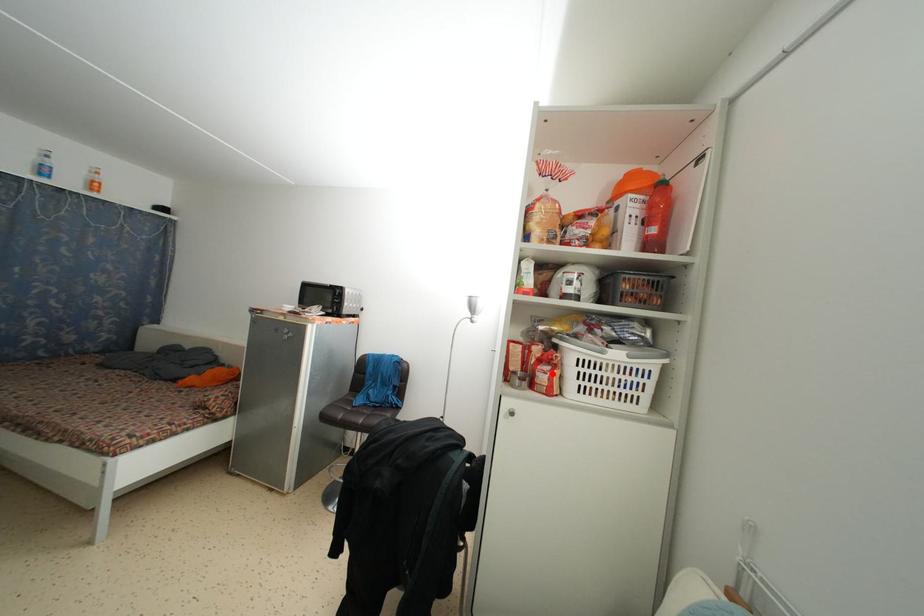
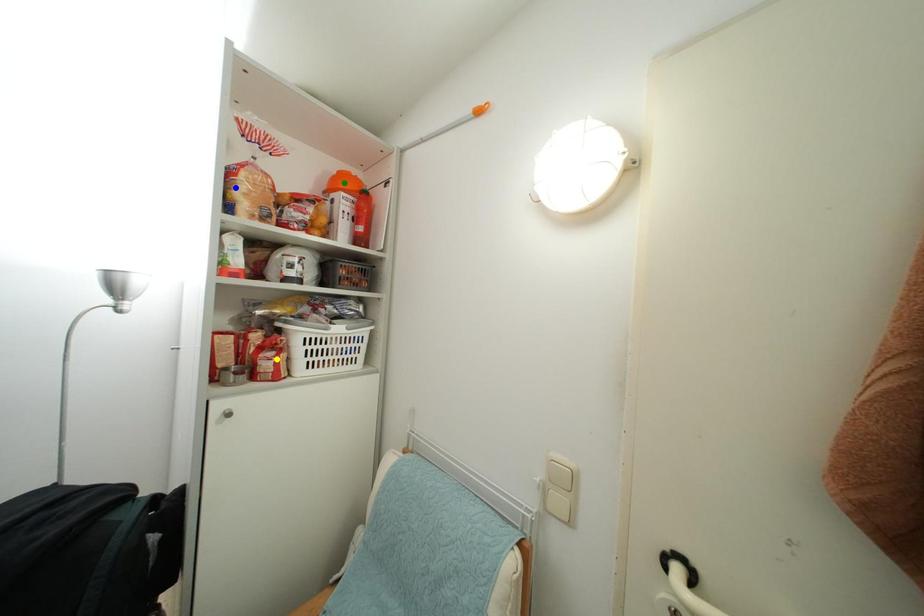
Question: I am providing you with two images of the same scene from different viewpoints. A red point is marked on the first image. You are given multiple points on the second image. Which mark in image 2 goes with the point in image 1?

Choices:
 (A) yellow point
 (B) blue point
 (C) green point

Answer: (A)